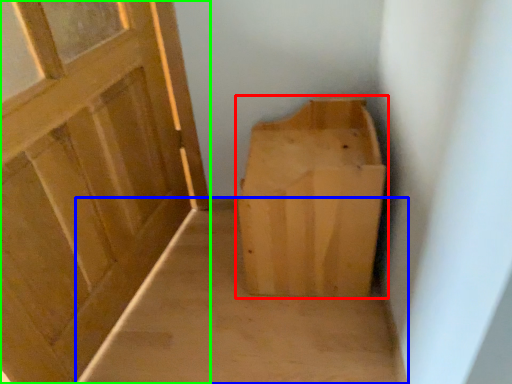
Question: Which object is the closest to the furniture (highlighted by a red box)? Choose among these: plain (highlighted by a blue box) or door (highlighted by a green box).

Choices:
 (A) plain
 (B) door

Answer: (A)